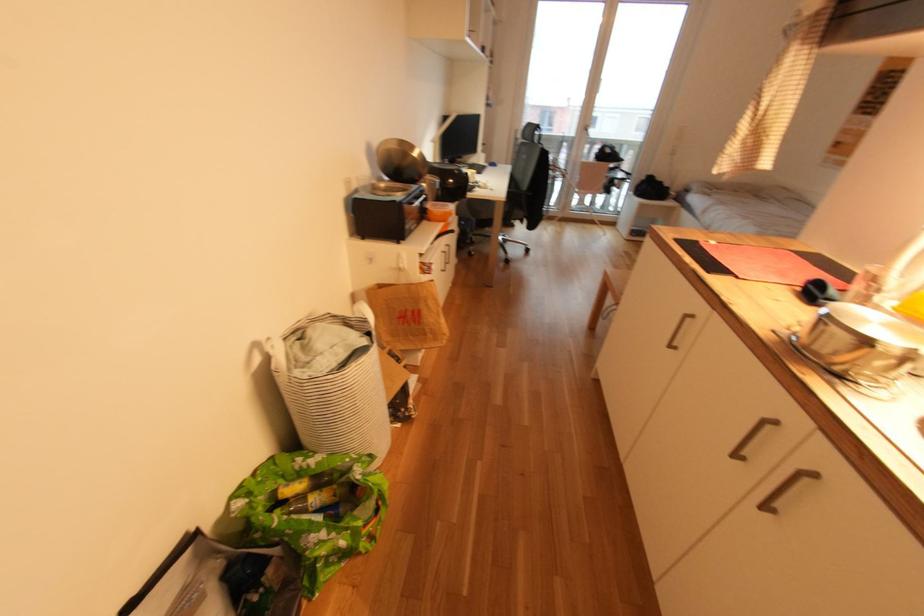
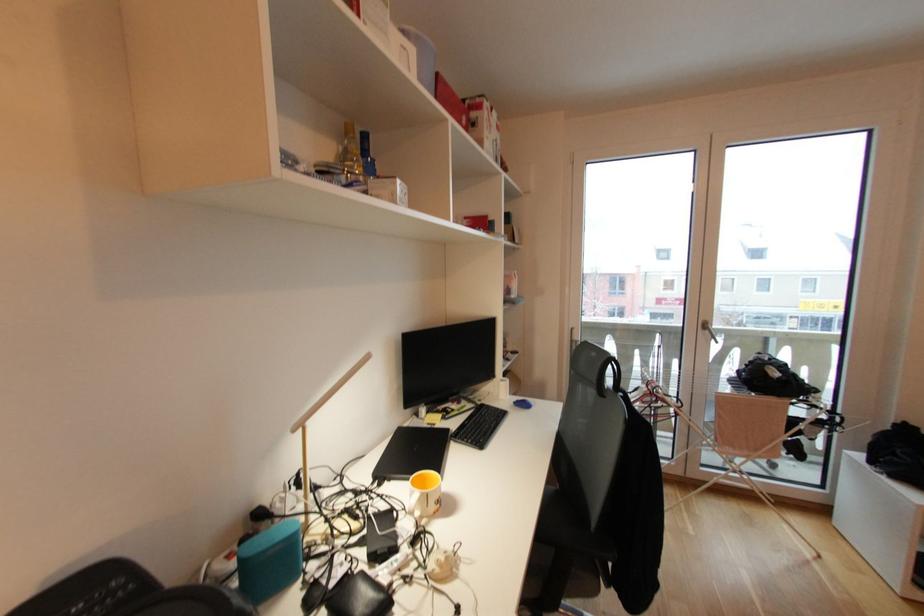
Question: Which direction would the cameraman need to move to produce the second image? Reply with the corresponding letter.

Choices:
 (A) Left
 (B) Right
 (C) Forward
 (D) Backward

Answer: (C)